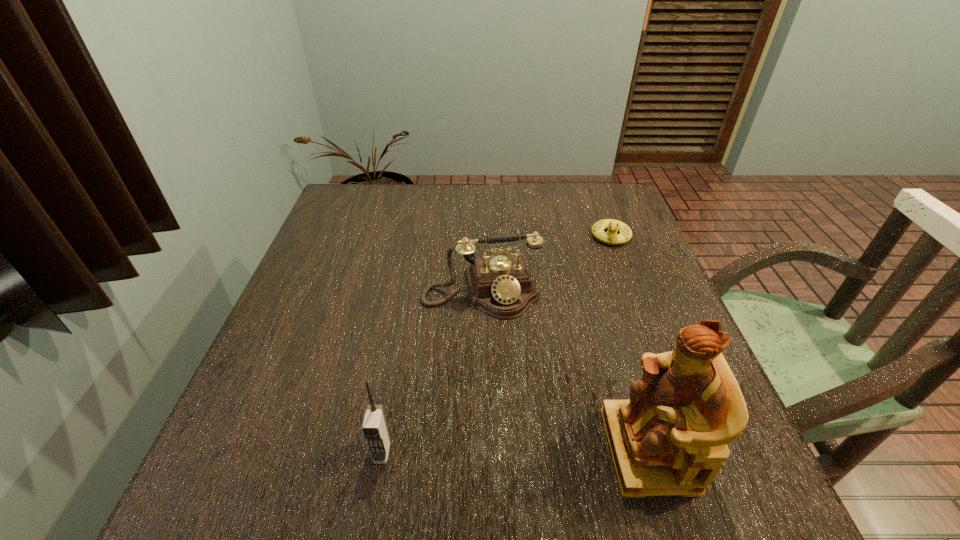
You are a GUI agent. You are given a task and a screenshot of the screen. Output one action in this format:
    pyautogui.click(x=<x>, y=<y>)
    Task: Click on the vacant space located on the face of the farthest object
    
    Given the screenshot: What is the action you would take?
    pyautogui.click(x=583, y=337)

This screenshot has height=540, width=960. I want to click on vacant space located on the face of the farthest object, so click(594, 298).

This screenshot has width=960, height=540. Identify the location of blank space located 0.160m on the dial of the second farthest object. (506, 377).

Where is `vacant space located on the dial of the second farthest object`? The width and height of the screenshot is (960, 540). vacant space located on the dial of the second farthest object is located at coordinates (506, 377).

The width and height of the screenshot is (960, 540). Identify the location of free space located on the dial of the second farthest object. (516, 418).

Identify the location of object that is at the far edge. (611, 237).

Identify the location of cellular telephone positioned at the near edge. This screenshot has height=540, width=960. (375, 430).

Where is `figurine present at the near edge`? The width and height of the screenshot is (960, 540). figurine present at the near edge is located at coordinates (670, 438).

At what (x,y) coordinates should I click in order to perform the action: click on figurine at the right edge. Please return your answer as a coordinate pair (x, y). Looking at the image, I should click on (670, 438).

Find the location of a particular element. duckling that is at the right edge is located at coordinates (611, 237).